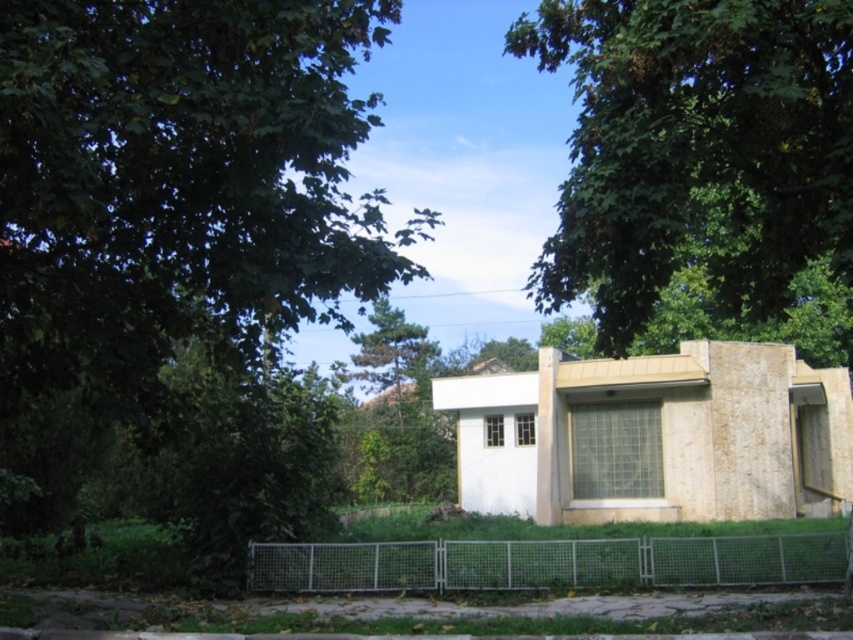
Question: Which of the following is the farthest from the observer?

Choices:
 (A) green leafy tree at upper center
 (B) metallic wire mesh fence at lower center

Answer: (B)

Question: Does green leafy tree at upper center have a lesser width compared to metallic wire mesh fence at lower center?

Choices:
 (A) no
 (B) yes

Answer: (A)

Question: Considering the relative positions of green leafy tree at upper center and metallic wire mesh fence at lower center in the image provided, where is green leafy tree at upper center located with respect to metallic wire mesh fence at lower center?

Choices:
 (A) right
 (B) left

Answer: (A)

Question: Is green leafy tree at upper center closer to camera compared to metallic wire mesh fence at lower center?

Choices:
 (A) yes
 (B) no

Answer: (A)

Question: Which object appears closest to the camera in this image?

Choices:
 (A) metallic wire mesh fence at lower center
 (B) green leafy tree at upper center

Answer: (B)

Question: Which of the following is the farthest from the observer?

Choices:
 (A) metallic wire mesh fence at lower center
 (B) green leafy tree at upper center

Answer: (A)